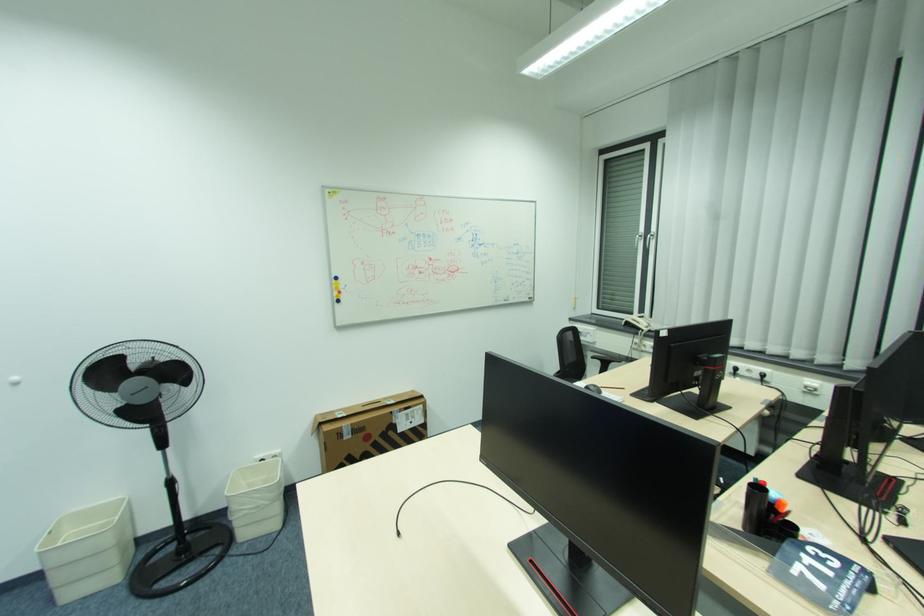
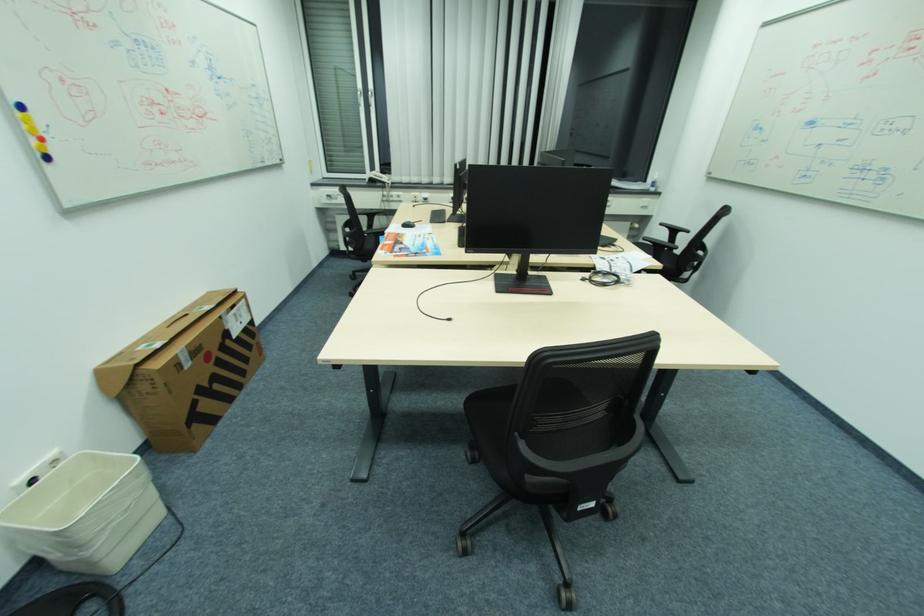
Where in the second image is the point corresponding to (x=339, y=282) from the first image?

(21, 114)